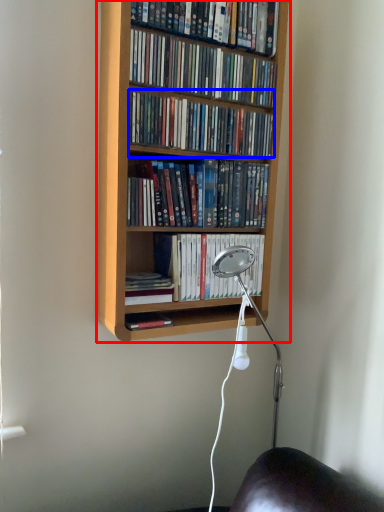
Question: Which point is further to the camera, bookcase (highlighted by a red box) or book (highlighted by a blue box)?

Choices:
 (A) bookcase
 (B) book

Answer: (B)